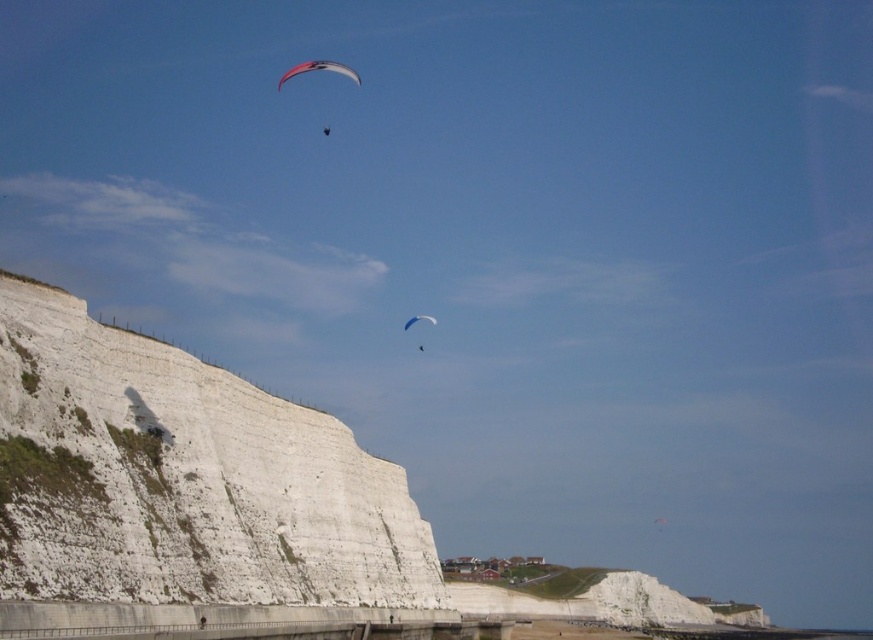
You are standing at the base of the large white cliff on the left side and want to reach the point marked as point (12, 326). Given that the walkway in the foreground is 50 meters long, can you walk directly to the point without needing to traverse the cliff itself?

The point (12, 326) is 63.19 meters away from you. Since the walkway is only 50 meters long, you would need to go beyond the walkway to reach the point, which might require traversing the cliff or finding another path.

You are standing at the center of the walkway and want to take a photo of the white smooth cliff at left. In which direction should you point your camera to capture it?

The white smooth cliff at left is located at point coordinates, so you should point your camera to the left to capture it.

You are a hiker standing on the walkway near the base of the large white cliff on the left. You see two parachutes above you at the upper center of the scene. The parachutes are labeled as matte pink parachute at upper center and white matte parachute at upper center. If you want to retrieve both parachutes, which one would you reach first if they both start falling at the same time?

Both parachutes would reach the ground at the same time because they are falling from the same height and the distance between them does not affect their descent speed. However, the matte pink parachute at upper center and white matte parachute at upper center are 71.98 meters apart horizontally, so their landing positions might be different depending on wind direction.